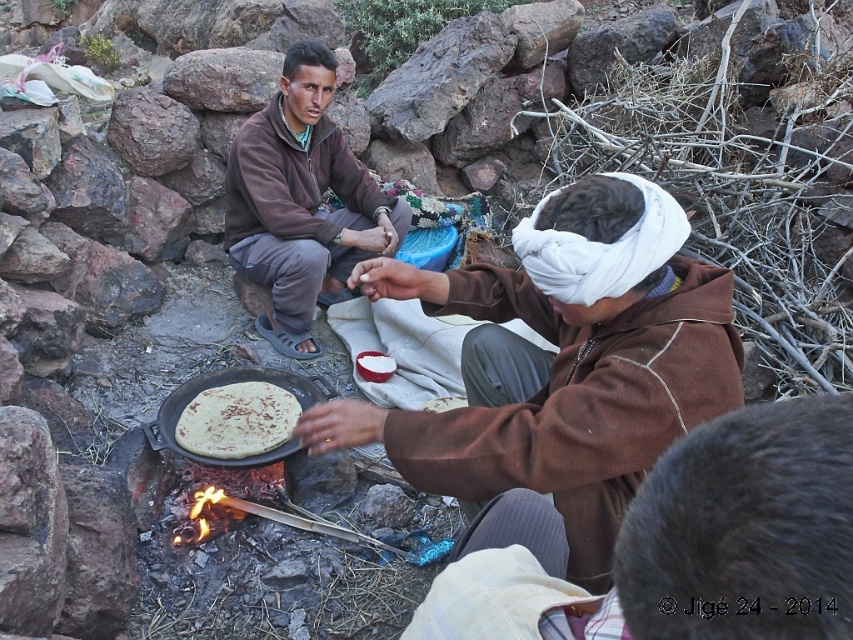
Question: Observing the image, what is the correct spatial positioning of brown soft cloth at center in reference to brown matte flatbread at center?

Choices:
 (A) above
 (B) below

Answer: (A)

Question: Based on their relative distances, which object is farther from the brown soft cloth at center?

Choices:
 (A) brown fleece jacket at center
 (B) brown matte flatbread at center

Answer: (A)

Question: Which object is closer to the camera taking this photo?

Choices:
 (A) brown matte flatbread at center
 (B) brown soft cloth at center
 (C) brown fleece jacket at center

Answer: (B)

Question: Which point is closer to the camera?

Choices:
 (A) brown fleece jacket at center
 (B) brown matte flatbread at center
 (C) brown soft cloth at center

Answer: (C)

Question: Can you confirm if brown soft cloth at center is smaller than brown fleece jacket at center?

Choices:
 (A) yes
 (B) no

Answer: (A)

Question: From the image, what is the correct spatial relationship of brown fleece jacket at center in relation to brown matte flatbread at center?

Choices:
 (A) left
 (B) right

Answer: (B)